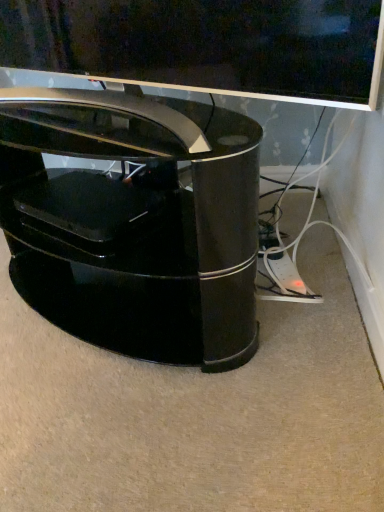
What do you see at coordinates (135, 221) in the screenshot? This screenshot has height=512, width=384. I see `glossy black coffee table at center` at bounding box center [135, 221].

In order to face glossy black coffee table at center, should I rotate leftwards or rightwards?

Turn left by 12.351 degrees to look at glossy black coffee table at center.

Image resolution: width=384 pixels, height=512 pixels. Find the location of `glossy black coffee table at center`. glossy black coffee table at center is located at coordinates (135, 221).

This screenshot has width=384, height=512. In order to click on glossy black coffee table at center in this screenshot , I will do `click(135, 221)`.